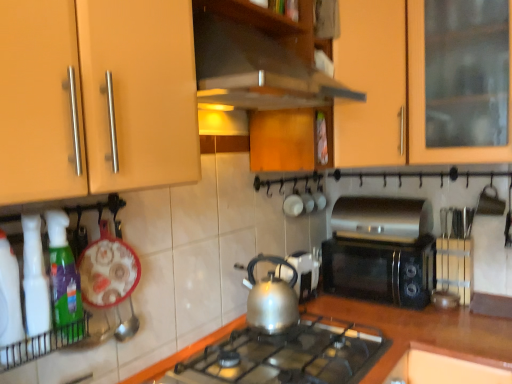
Identify the location of free space in front of silver metallic kettle at center. The image size is (512, 384). (317, 310).